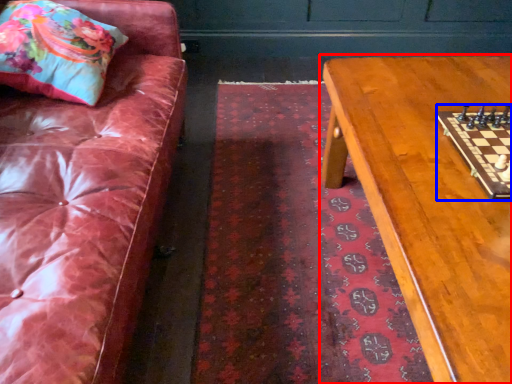
Question: Which of the following is the closest to the observer, table (highlighted by a red box) or board game (highlighted by a blue box)?

Choices:
 (A) table
 (B) board game

Answer: (A)